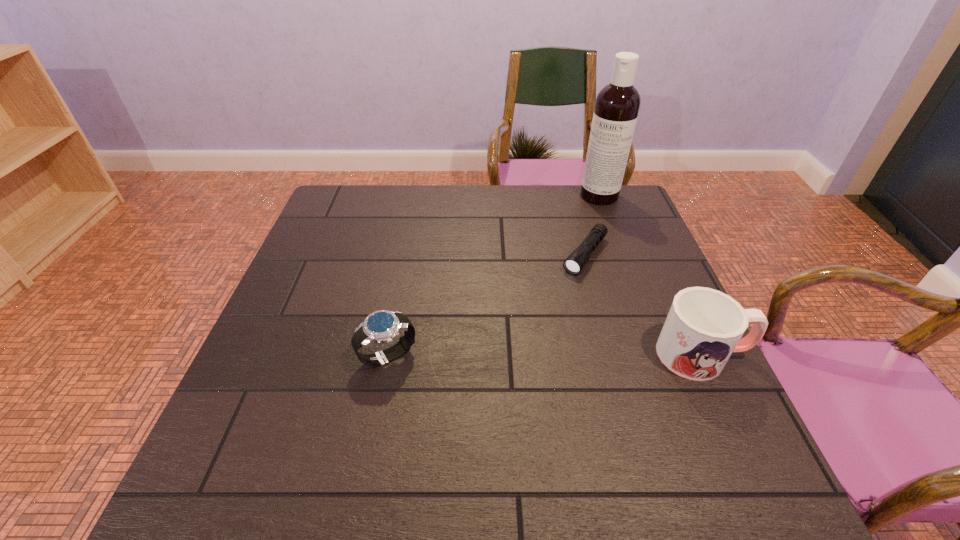
Where is `empty location between the third tallest object and the second tallest object`? The image size is (960, 540). empty location between the third tallest object and the second tallest object is located at coordinates (545, 355).

I want to click on vacant space in between the tallest object and the mug, so click(x=651, y=275).

The image size is (960, 540). What are the coordinates of `free spot between the shortest object and the third shortest object` in the screenshot? It's located at (643, 305).

Identify the location of vacant space in between the tallest object and the mug. The image size is (960, 540). (651, 275).

Where is `object that can be found as the second closest to the second shortest object`? object that can be found as the second closest to the second shortest object is located at coordinates (704, 326).

Locate an element on the screen. This screenshot has height=540, width=960. the second closest object to the shortest object is located at coordinates (704, 326).

Identify the location of vacant space that satisfies the following two spatial constraints: 1. on the back side of the watch; 2. on the side of the mug with the handle. The width and height of the screenshot is (960, 540). (388, 354).

In order to click on free space that satisfies the following two spatial constraints: 1. on the front side of the mug; 2. on the side of the farthest object with the handle in this screenshot , I will do `click(659, 354)`.

Where is `blank space that satisfies the following two spatial constraints: 1. on the back side of the flashlight; 2. on the right side of the dishwasher detergent`? Image resolution: width=960 pixels, height=540 pixels. blank space that satisfies the following two spatial constraints: 1. on the back side of the flashlight; 2. on the right side of the dishwasher detergent is located at coordinates (568, 195).

The height and width of the screenshot is (540, 960). In order to click on free space that satisfies the following two spatial constraints: 1. on the back side of the farthest object; 2. on the right side of the third nearest object in this screenshot , I will do `click(568, 195)`.